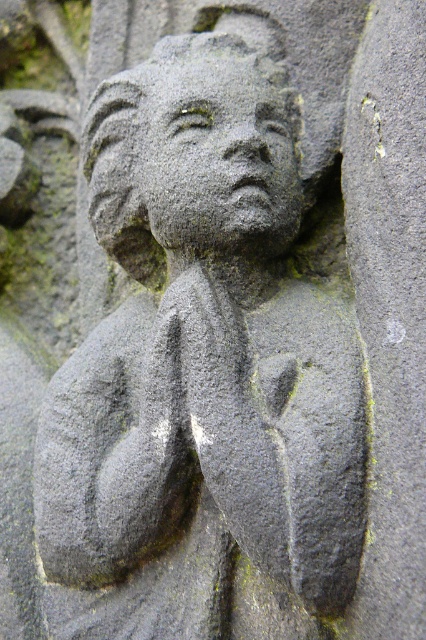
You are an art conservator examining the stone carving. You notice two points of interest marked as point (x=118, y=211) and point (x=291, y=189). Which point is closer to your eyes?

Point (x=118, y=211) is further to the viewer than point (x=291, y=189), so the point closer to your eyes is point (x=291, y=189).

You are an archaeologist examining the stone carving. You notice a specific point at coordinates (192, 154). What object is located at that point?

The gray stone head at center is located at point (192, 154).